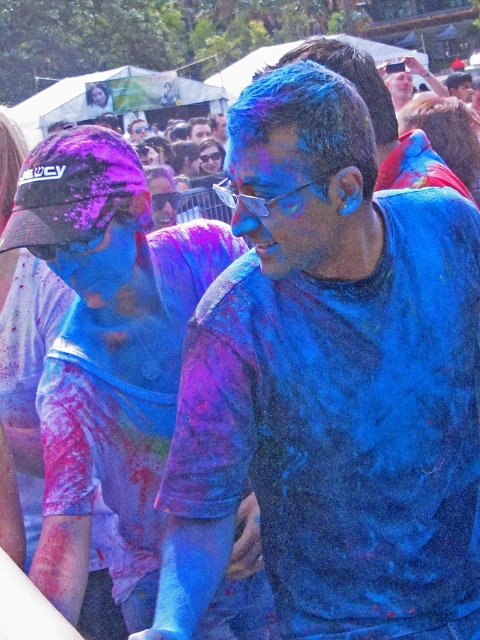
You are at the festival and want to find the blue matte shirt at center. According to the coordinates given, where should you look?

You should look at point (330, 384) to find the blue matte shirt at center.

You are a photographer standing at the event, and you want to capture a closeup shot of the matte blue shirt at center. Given that your camera has a minimum focusing distance of 5 feet, will you be able to take the photo without moving closer?

The matte blue shirt at center is 5.51 feet away from the camera. Since the minimum focusing distance is 5 feet, you can take the closeup shot without moving closer because the distance is within the camera range.